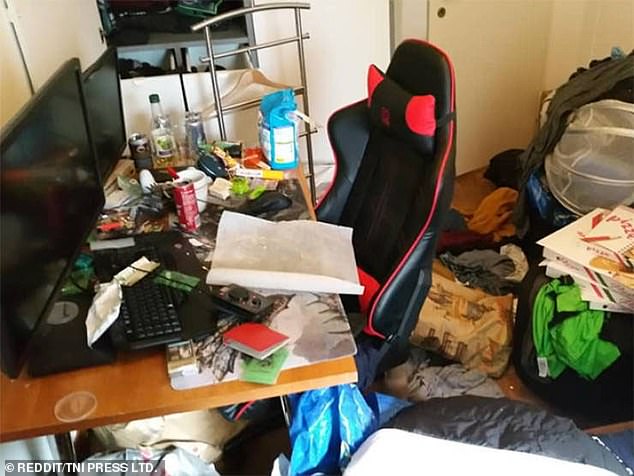
The image size is (634, 476). In order to click on bottle in this screenshot , I will do `click(162, 133)`.